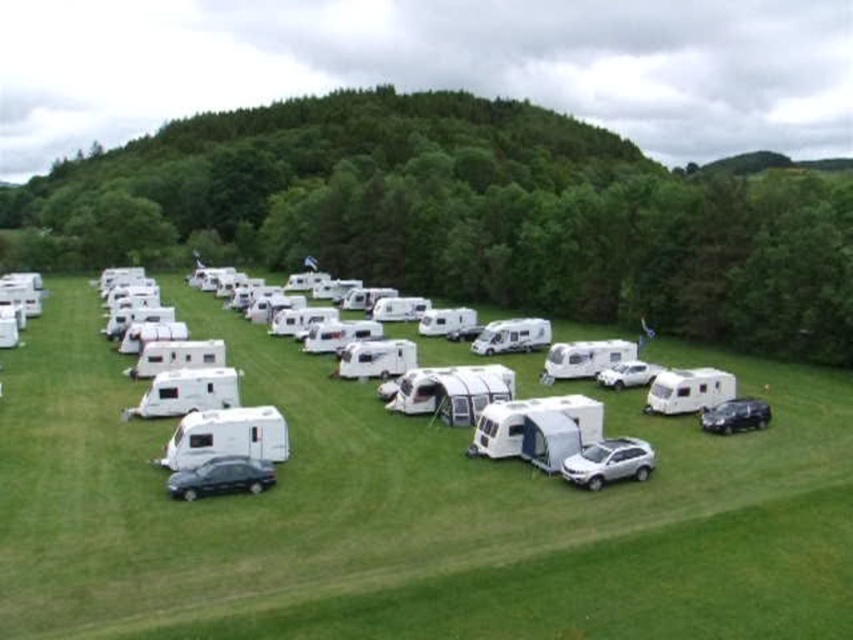
You are a visitor arriving at the camping area and want to park your car between the shiny dark gray car at lower left and the satin black car at lower right. Is there enough space between them to fit your compact car?

The shiny dark gray car at lower left is positioned on the left side of the satin black car at lower right, so there is space between them. However, the description does not provide the exact distance between the two cars. Without knowing the distance, it is impossible to determine if your compact car can fit between them.

You are standing at the point marked by the coordinates point (x=221, y=477) in the camping area. What object is located at this point?

The point (x=221, y=477) indicates a shiny dark gray car at lower left.